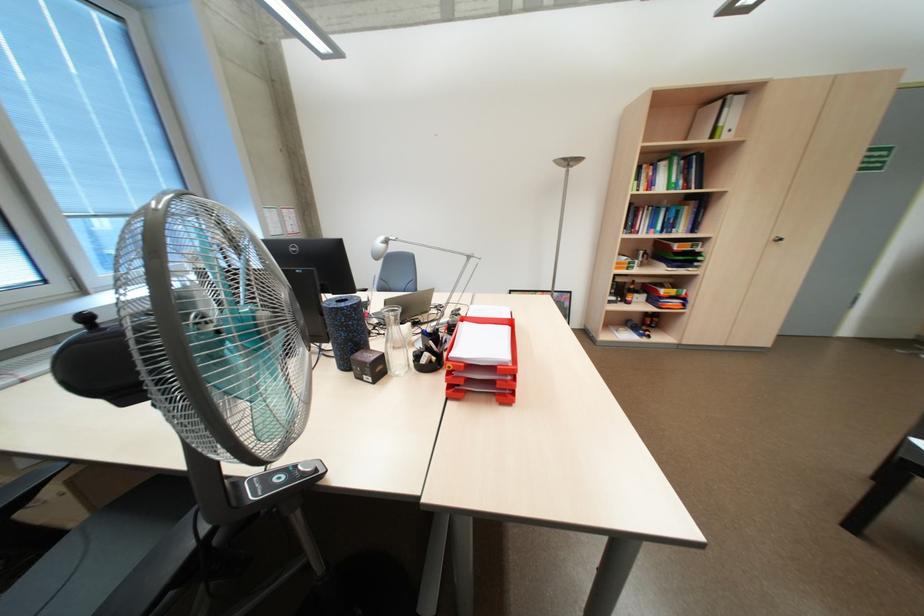
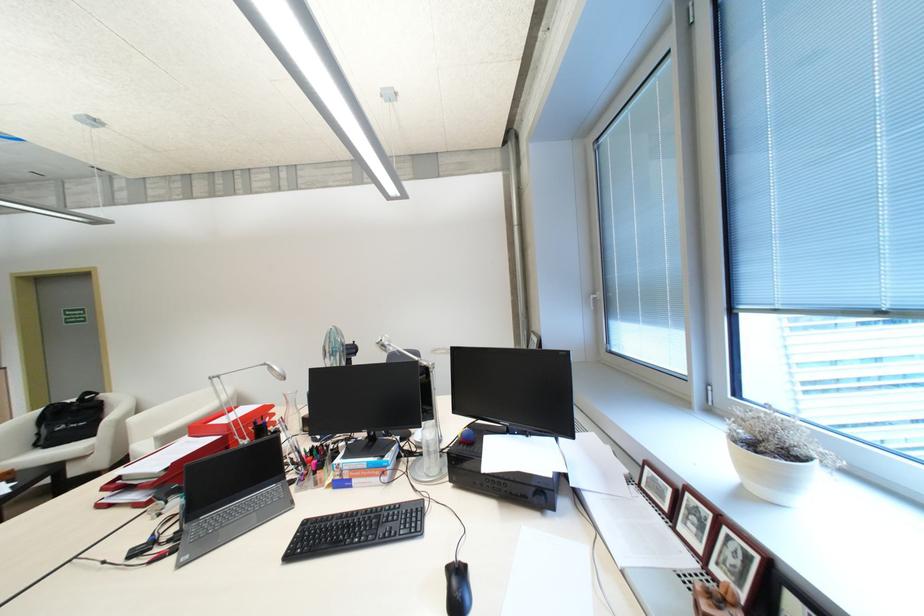
Question: I am providing you with two images of the same scene from different viewpoints. After the viewpoint changes to image2, which objects are now occluded?

Choices:
 (A) pen in holder
 (B) black receiver knob
 (C) yellow cleaner bottle
 (D) chair armrest

Answer: (A)